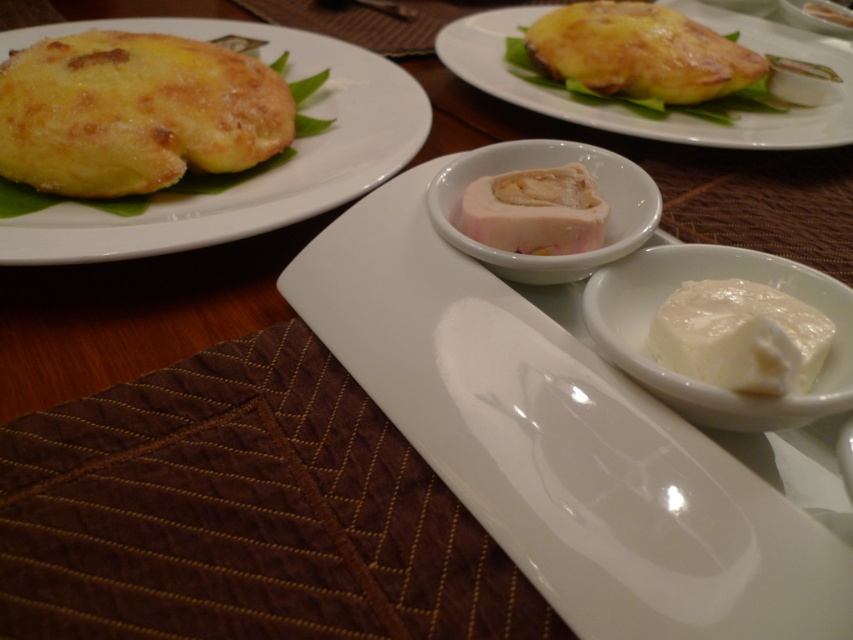
Question: Is golden-brown crispy pastry at upper center positioned behind white creamy sauce at center?

Choices:
 (A) no
 (B) yes

Answer: (A)

Question: Which object is the closest to the white glossy rectangular plate at center?

Choices:
 (A) golden-brown crispy pastry at upper center
 (B) yellow cheesy bread at upper center
 (C) yellow cheesy pancake at upper left
 (D) pink creamy rolled meat at center

Answer: (D)

Question: Which of the following is the closest to the observer?

Choices:
 (A) (410, 230)
 (B) (502, 173)

Answer: (A)

Question: Among these points, which one is farthest from the camera?

Choices:
 (A) (234, 77)
 (B) (822, 10)
 (C) (564, 80)

Answer: (B)

Question: Can you confirm if golden-brown crispy pastry at upper center is positioned below yellow cheesy bread at upper center?

Choices:
 (A) no
 (B) yes

Answer: (A)

Question: Is white glossy rectangular plate at center to the right of white creamy spread at center from the viewer's perspective?

Choices:
 (A) yes
 (B) no

Answer: (B)